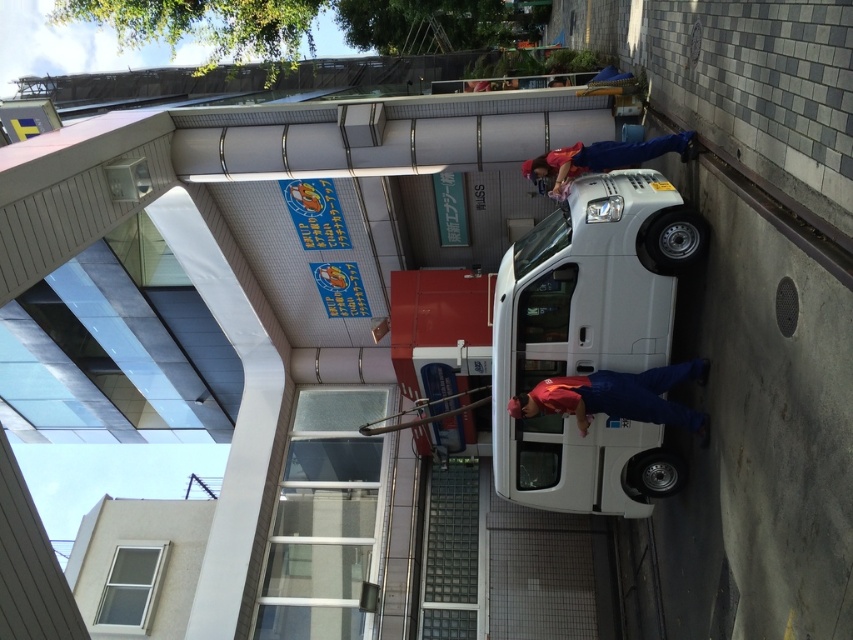
Looking at this image, you are a pedestrian standing on the sidewalk and see the white glossy van at center and the matte red shirt at upper right. Which object is nearer to you?

The white glossy van at center is closer to the viewer than the matte red shirt at upper right.

You are a delivery person who needs to park your vehicle to the left of the red matte uniform at center. Is the white glossy van at center currently blocking the parking spot?

The white glossy van at center is to the right of the red matte uniform at center, so it is not blocking the parking spot to the left of the red matte uniform at center. You can park there.

You are a delivery person standing next to the white glossy van at center. You need to hand over a package to the person wearing the matte red shirt at upper right. Can you reach them without moving from your current position?

The distance between the white glossy van at center and the matte red shirt at upper right is 1.43 meters. Since the average human arm span is about 1.5 meters, you can just barely reach them without moving.